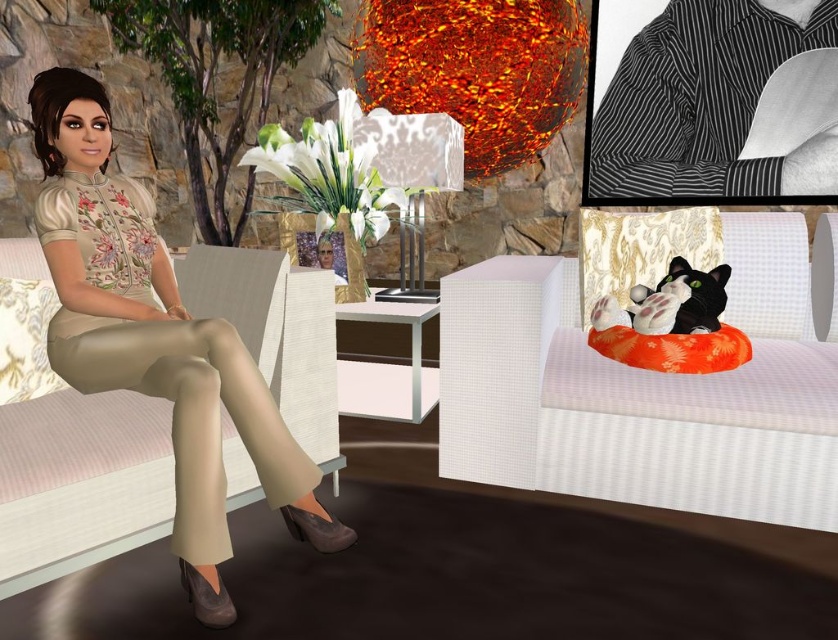
Question: Can you confirm if beige fabric pants at left is positioned to the right of striped fabric shirt at upper right?

Choices:
 (A) no
 (B) yes

Answer: (A)

Question: Does beige fabric pants at left appear on the left side of striped fabric shirt at upper right?

Choices:
 (A) yes
 (B) no

Answer: (A)

Question: Does orange fabric couch at right lie in front of striped fabric shirt at upper right?

Choices:
 (A) no
 (B) yes

Answer: (B)

Question: Which object appears farthest from the camera in this image?

Choices:
 (A) striped fabric shirt at upper right
 (B) orange fabric couch at right
 (C) beige fabric pants at left

Answer: (A)

Question: Estimate the real-world distances between objects in this image. Which object is farther from the orange fabric couch at right?

Choices:
 (A) beige fabric pants at left
 (B) striped fabric shirt at upper right

Answer: (B)

Question: Based on their relative distances, which object is farther from the beige fabric pants at left?

Choices:
 (A) orange fabric couch at right
 (B) striped fabric shirt at upper right

Answer: (B)